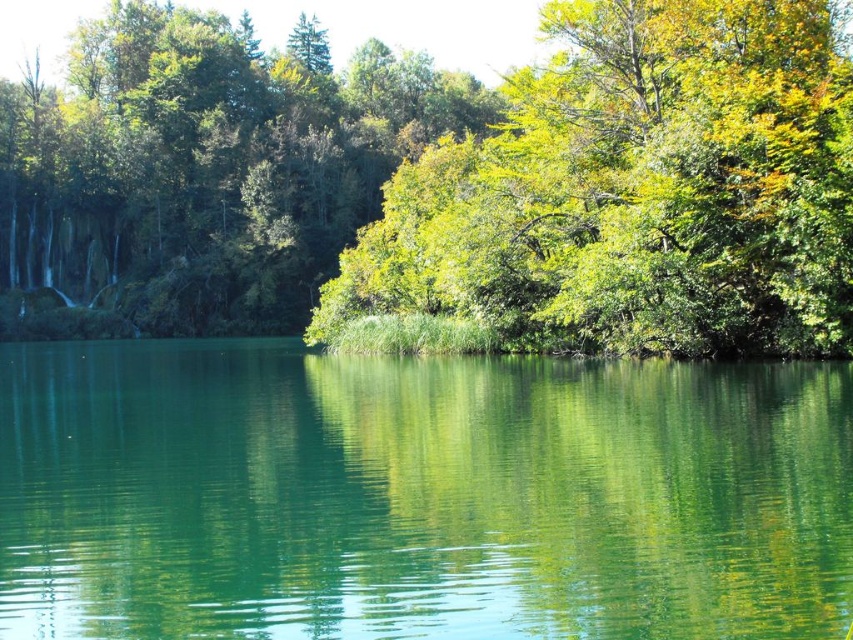
You are standing at the edge of the water and want to take a photo of both the green leafy tree at center and the green smooth water at center. Which object will appear closer to the camera in the photo?

The green leafy tree at center will appear closer to the camera because it is in front of the green smooth water at center.

You are standing at the edge of the water and want to determine which object is taller between the green leafy tree at center and the green smooth water at center. Based on the scene, which one is taller?

The green leafy tree at center is taller than the green smooth water at center.